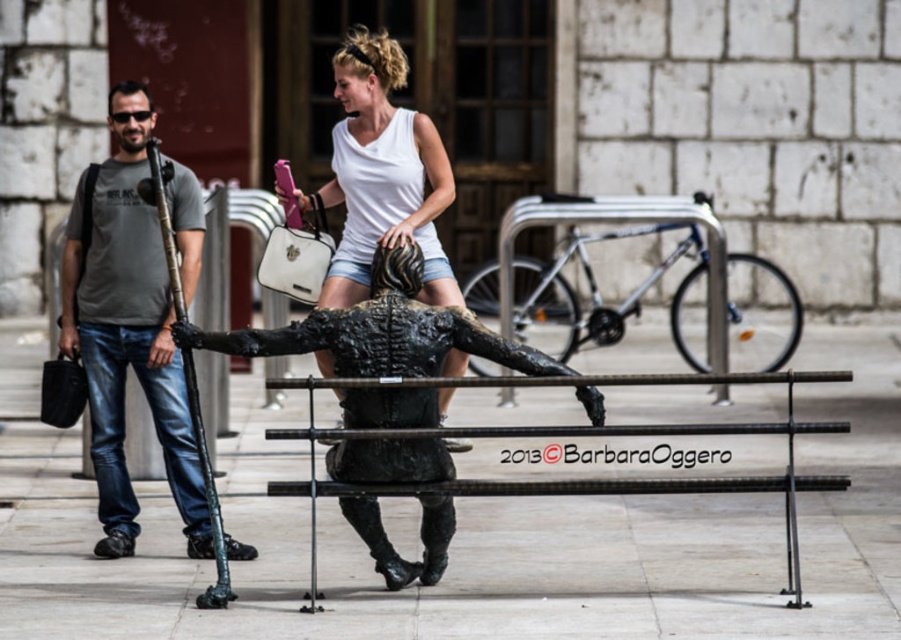
Question: Which object is closer to the camera taking this photo?

Choices:
 (A) white matte tank top at center
 (B) gray matte t-shirt at left
 (C) black matte bronze sculpture at center

Answer: (C)

Question: Is gray matte t-shirt at left to the left of white matte tank top at center from the viewer's perspective?

Choices:
 (A) yes
 (B) no

Answer: (A)

Question: Which point is farther to the camera?

Choices:
 (A) (802, 476)
 (B) (360, 518)
 (C) (119, 163)
 (D) (458, 301)

Answer: (D)

Question: Does black matte bronze sculpture at center lie behind black metal bench at center?

Choices:
 (A) no
 (B) yes

Answer: (B)

Question: Estimate the real-world distances between objects in this image. Which object is farther from the black metal bench at center?

Choices:
 (A) white matte tank top at center
 (B) black matte bronze sculpture at center
 (C) gray matte t-shirt at left

Answer: (B)

Question: Does black matte bronze sculpture at center appear on the right side of black metal bench at center?

Choices:
 (A) no
 (B) yes

Answer: (A)